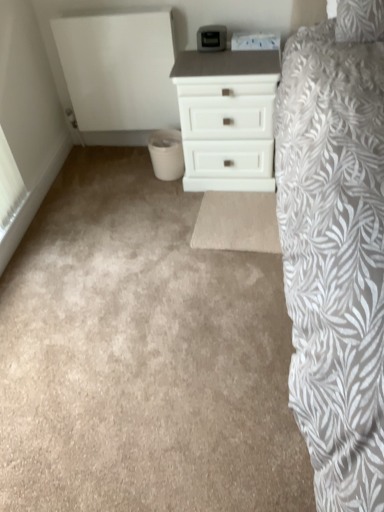
Identify the location of vacant area that is in front of white matte chest of drawers at center. (213, 216).